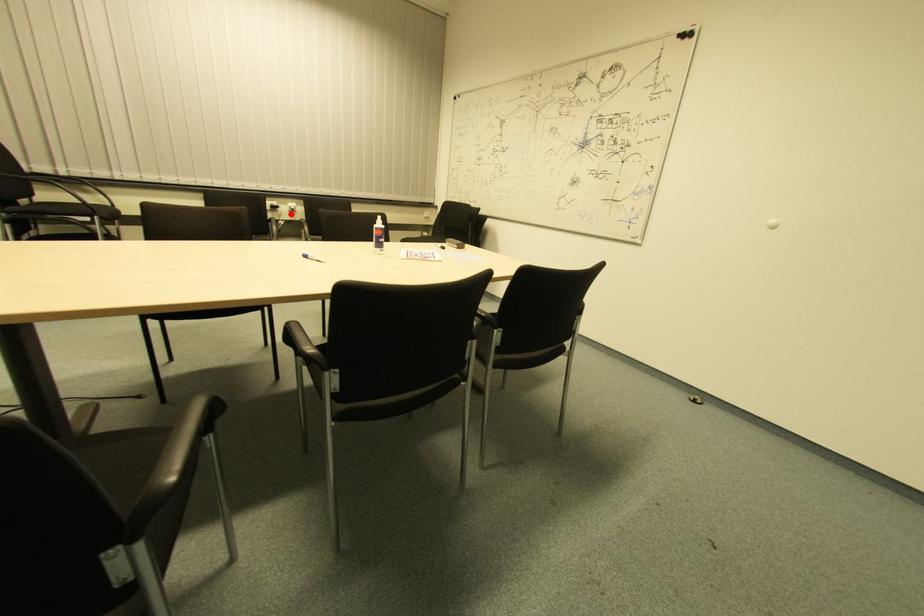
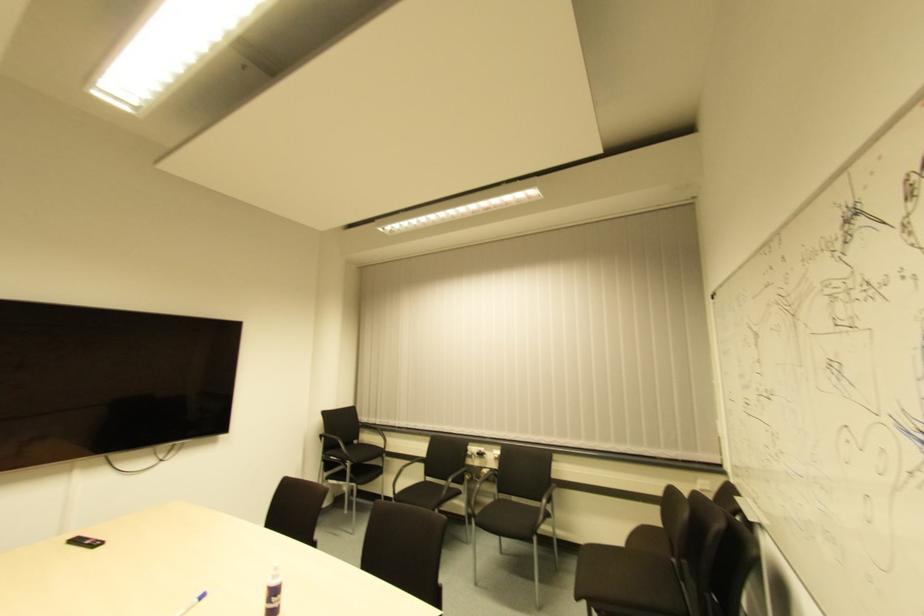
Question: I am providing you with two images of the same scene from different viewpoints. A red point is marked on the first image. Can you still see the location of the red point in image 2?

Choices:
 (A) Yes
 (B) No

Answer: (A)